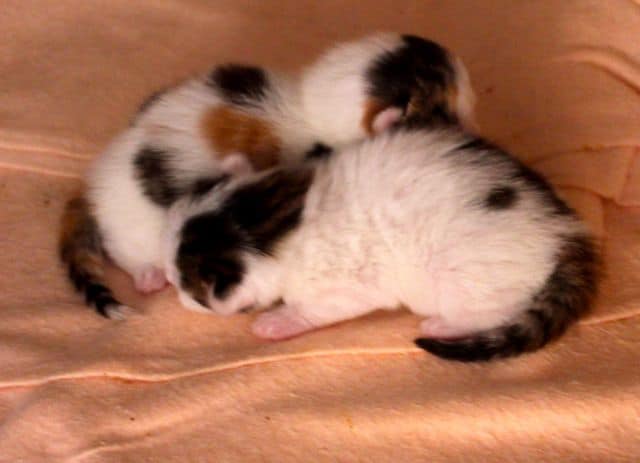
This screenshot has width=640, height=463. Find the location of `blanket`. blanket is located at coordinates (67, 385).